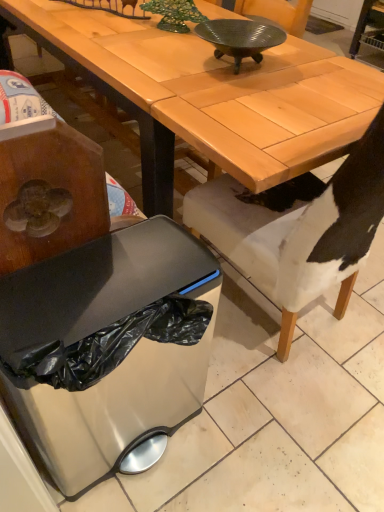
Locate an element on the screen. This screenshot has height=512, width=384. free space underneath metallic ribbed bowl at center (from a real-world perspective) is located at coordinates (232, 68).